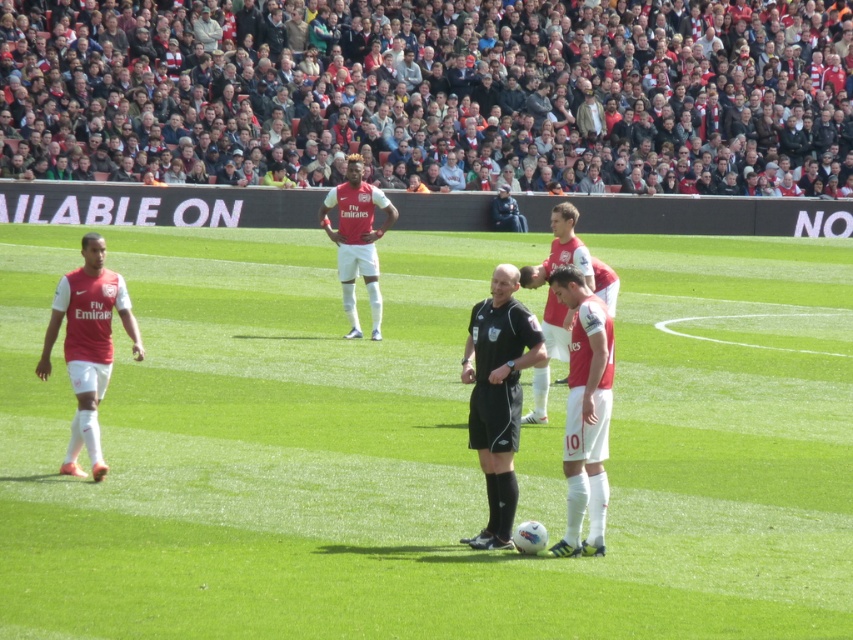
Does white matte jersey at center have a greater width compared to matte red jersey at center?

In fact, white matte jersey at center might be narrower than matte red jersey at center.

Is white matte jersey at center behind matte red jersey at center?

No, it is not.

Which is behind, point (602, 483) or point (579, 268)?

Positioned behind is point (579, 268).

Locate an element on the screen. Image resolution: width=853 pixels, height=640 pixels. white matte jersey at center is located at coordinates (584, 408).

Measure the distance between point (364, 193) and camera.

The distance of point (364, 193) from camera is 20.70 meters.

Which is in front, point (340, 246) or point (546, 260)?

Point (546, 260) is in front.

Identify the location of white matte soccer player at center. The image size is (853, 640). (357, 240).

The width and height of the screenshot is (853, 640). I want to click on white matte soccer player at center, so click(357, 240).

Which is more to the right, matte red jersey at left or matte red jersey at center?

From the viewer's perspective, matte red jersey at center appears more on the right side.

Who is more forward, (103, 339) or (549, 257)?

Point (103, 339) is more forward.

Locate an element on the screen. This screenshot has width=853, height=640. matte red jersey at left is located at coordinates (88, 344).